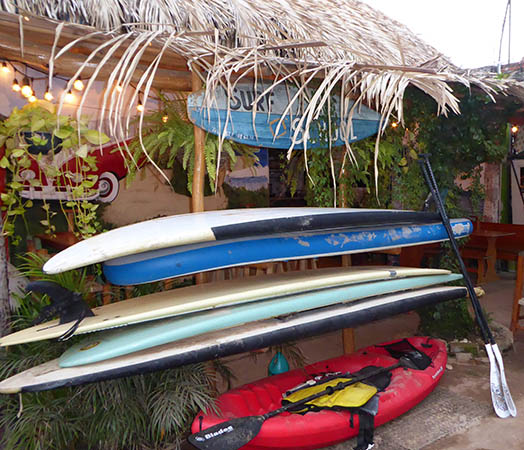
Image resolution: width=524 pixels, height=450 pixels. I want to click on seating area, so click(x=502, y=231).